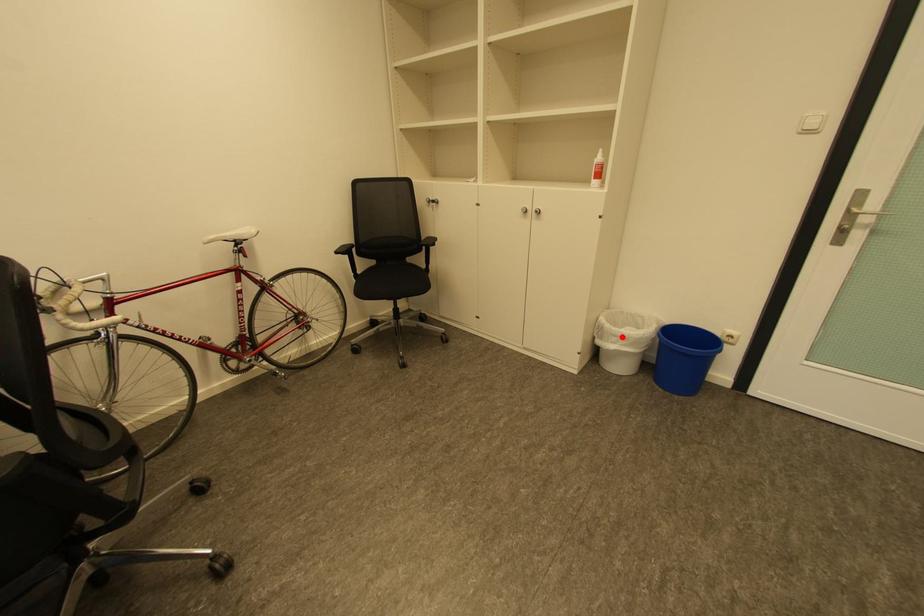
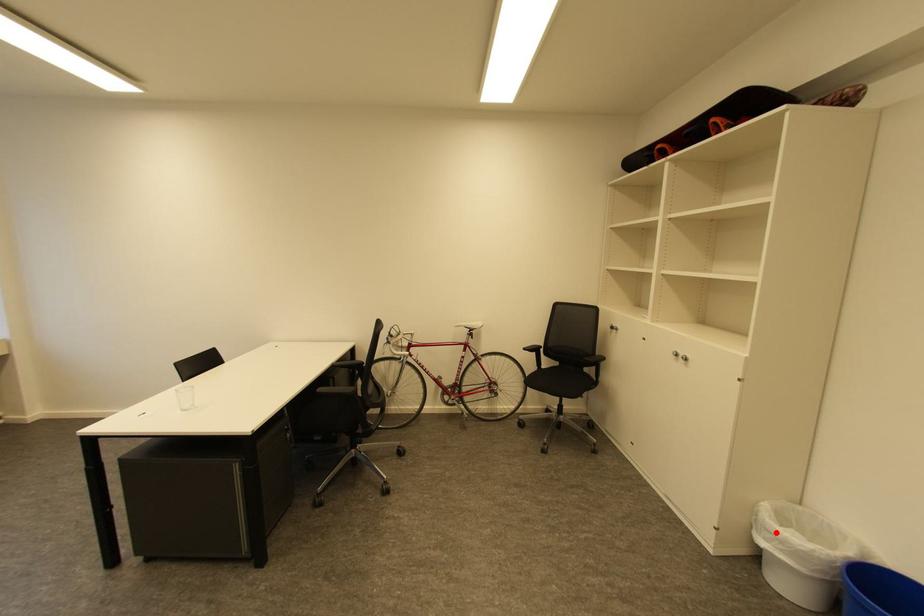
I am providing you with two images of the same scene from different viewpoints. A red point is marked on the first image and another point is marked on the second image. Does the point marked in image1 correspond to the same location as the one in image2?

Yes